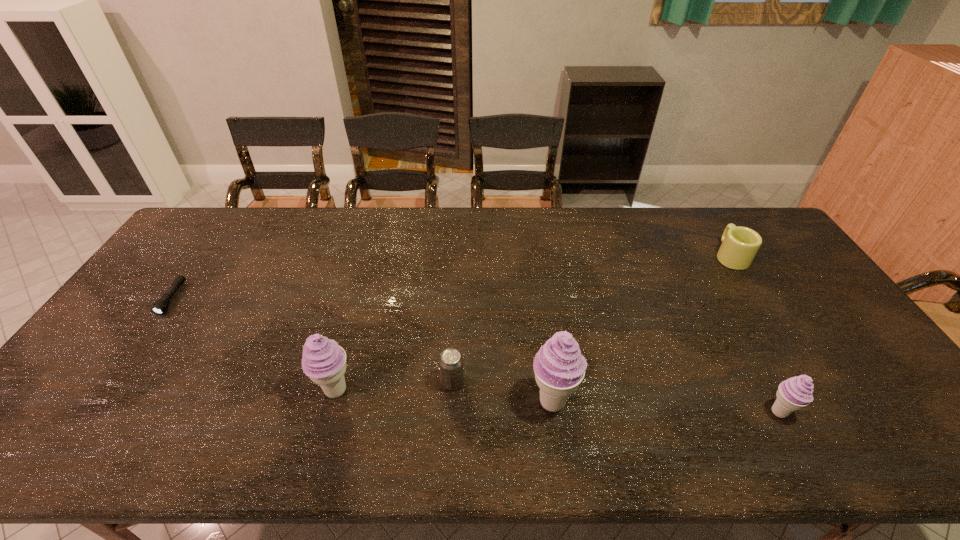
Identify the location of object present at the left edge. This screenshot has height=540, width=960. (161, 305).

Find the location of `object located at the right edge`. object located at the right edge is located at coordinates (740, 245).

You are a GUI agent. You are given a task and a screenshot of the screen. Output one action in this format:
    pyautogui.click(x=<x>, y=<y>)
    Task: Click on the object situated at the far right corner
    Image resolution: width=960 pixels, height=540 pixels.
    Given the screenshot: What is the action you would take?
    pyautogui.click(x=740, y=245)

In the image, there is a desktop. Identify the location of vacant region at the far edge. This screenshot has width=960, height=540. (516, 225).

The width and height of the screenshot is (960, 540). I want to click on vacant space at the near edge, so click(153, 416).

In the image, there is a desktop. Where is `vacant region at the left edge`? vacant region at the left edge is located at coordinates (109, 341).

In the image, there is a desktop. What are the coordinates of `vacant space at the right edge` in the screenshot? It's located at pos(816,286).

Locate an element on the screen. free space at the far right corner is located at coordinates pos(755,211).

Where is `blank region between the rightmost object and the fifth shortest object`? This screenshot has width=960, height=540. blank region between the rightmost object and the fifth shortest object is located at coordinates (533, 323).

This screenshot has height=540, width=960. I want to click on unoccupied area between the second tallest object and the farthest object, so click(533, 323).